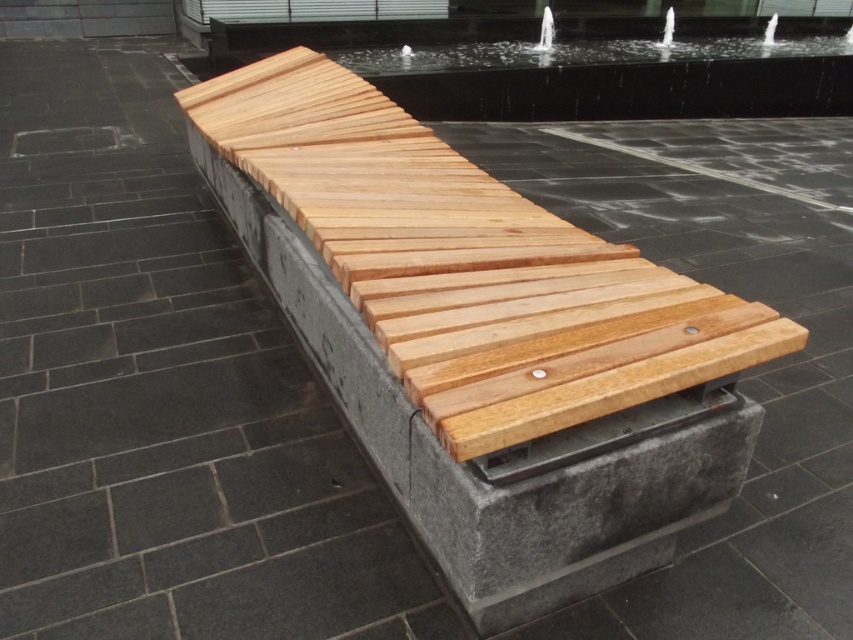
Question: Which point is farther from the camera taking this photo?

Choices:
 (A) (543, 29)
 (B) (521, 442)

Answer: (A)

Question: Does natural wood bench at center appear on the right side of clear glass water at upper center?

Choices:
 (A) no
 (B) yes

Answer: (A)

Question: Is natural wood bench at center bigger than clear glass water at upper center?

Choices:
 (A) no
 (B) yes

Answer: (B)

Question: Does natural wood bench at center appear on the right side of clear glass water at upper center?

Choices:
 (A) yes
 (B) no

Answer: (B)

Question: Which of the following is the closest to the observer?

Choices:
 (A) clear glass water at upper center
 (B) natural wood bench at center

Answer: (B)

Question: Which point is closer to the camera?

Choices:
 (A) (419, 436)
 (B) (543, 17)

Answer: (A)